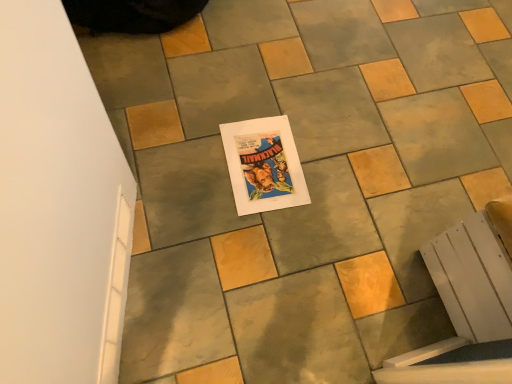
Locate an element on the screen. free space above vibrant paper comic book at center (from a real-world perspective) is located at coordinates (262, 162).